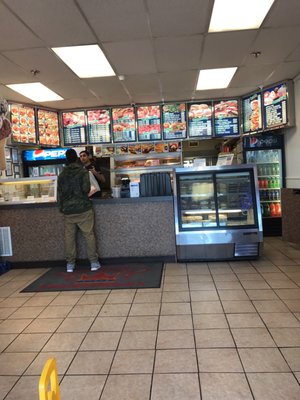
Identify the location of tile floor. Image resolution: width=300 pixels, height=400 pixels. 237,296, 13,329, 120,365.